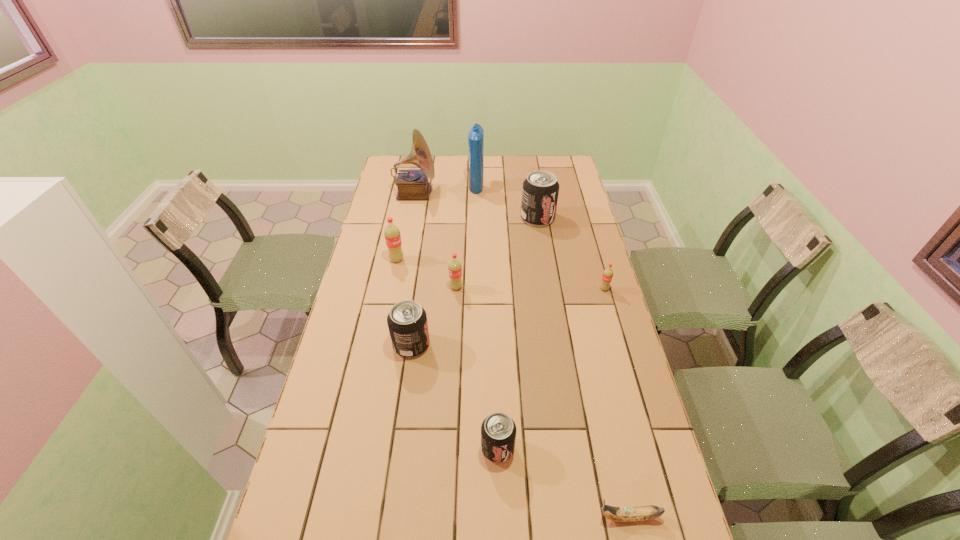
I want to click on vacant space positioned 0.240m on the back of the second smallest red soda, so click(x=459, y=241).

Locate an element on the screen. The width and height of the screenshot is (960, 540). free space located 0.250m on the back of the fifth farthest soda can is located at coordinates (420, 277).

Locate an element on the screen. The width and height of the screenshot is (960, 540). vacant space located 0.330m on the left of the rightmost object is located at coordinates (507, 289).

Identify the location of vacant position located 0.240m on the back of the fourth soda can from left to right. (495, 358).

Locate an element on the screen. This screenshot has width=960, height=540. vacant space located 0.050m on the peel of the nearest object is located at coordinates (575, 517).

Locate an element on the screen. This screenshot has height=540, width=960. blank area located on the peel of the nearest object is located at coordinates (571, 517).

You are a GUI agent. You are given a task and a screenshot of the screen. Output one action in this format:
    pyautogui.click(x=<x>, y=<y>)
    Task: Click on the free point located on the peel of the nearest object
    
    Given the screenshot: What is the action you would take?
    pyautogui.click(x=468, y=517)

I want to click on shampoo located at the far edge, so click(475, 137).

Where is `phonograph record located in the far edge section of the desktop`? phonograph record located in the far edge section of the desktop is located at coordinates (412, 184).

The height and width of the screenshot is (540, 960). Find the location of `phonograph record that is at the left edge`. phonograph record that is at the left edge is located at coordinates [x=412, y=184].